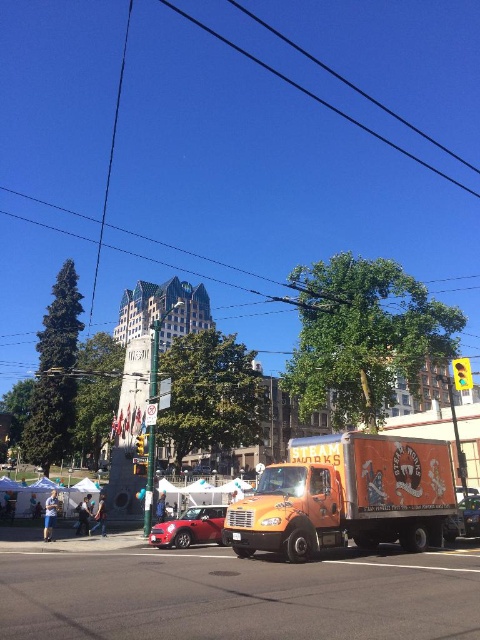
Question: Which point is farther to the camera?

Choices:
 (A) shiny red car at center
 (B) black wire at upper center
 (C) metallic silver car at center

Answer: (B)

Question: Is black wire at upper center thinner than metallic silver car at center?

Choices:
 (A) yes
 (B) no

Answer: (B)

Question: Is orange matte food truck at center to the right of metallic silver car at center from the viewer's perspective?

Choices:
 (A) yes
 (B) no

Answer: (B)

Question: Can you confirm if orange matte food truck at center is bigger than metallic silver car at center?

Choices:
 (A) yes
 (B) no

Answer: (A)

Question: Which point is closer to the camera taking this photo?

Choices:
 (A) [391, 456]
 (B) [215, 529]
 (C) [479, 195]

Answer: (A)

Question: Which of these objects is positioned closest to the metallic silver car at center?

Choices:
 (A) black wire at upper center
 (B) orange matte food truck at center
 (C) shiny red car at center

Answer: (B)